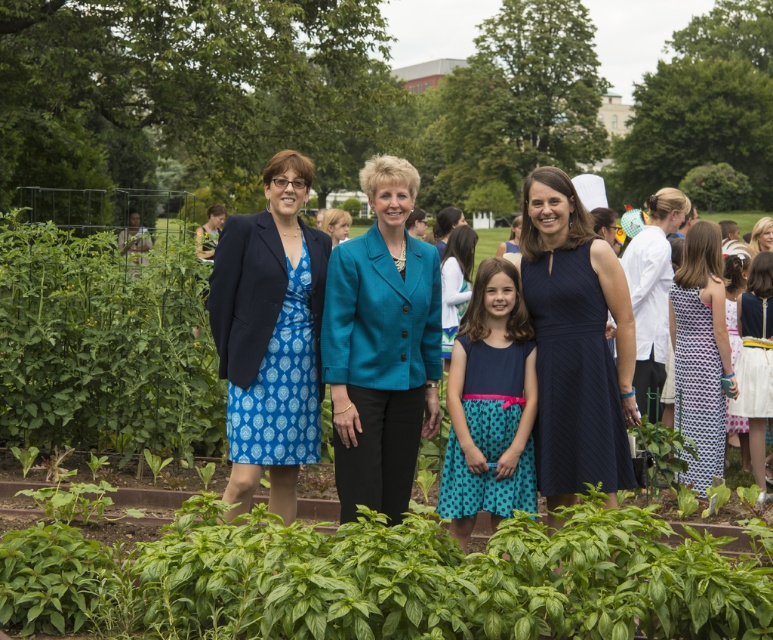
Based on the scene description, which object is taller between the green leafy plants at center and the white polka dot dress at right?

The white polka dot dress at right is taller than the green leafy plants at center.

Looking at this image, you are standing in the garden scene and want to take a photo of the group of four individuals. To ensure the entire group is in frame, where should you position the camera relative to the green leafy plant at left marked by point (104,346)?

To capture the entire group of four individuals in the garden scene, position the camera to the right of the green leafy plant at left marked by point (104,346). This ensures the lush foreground plants do not obstruct the view of the group standing behind them.